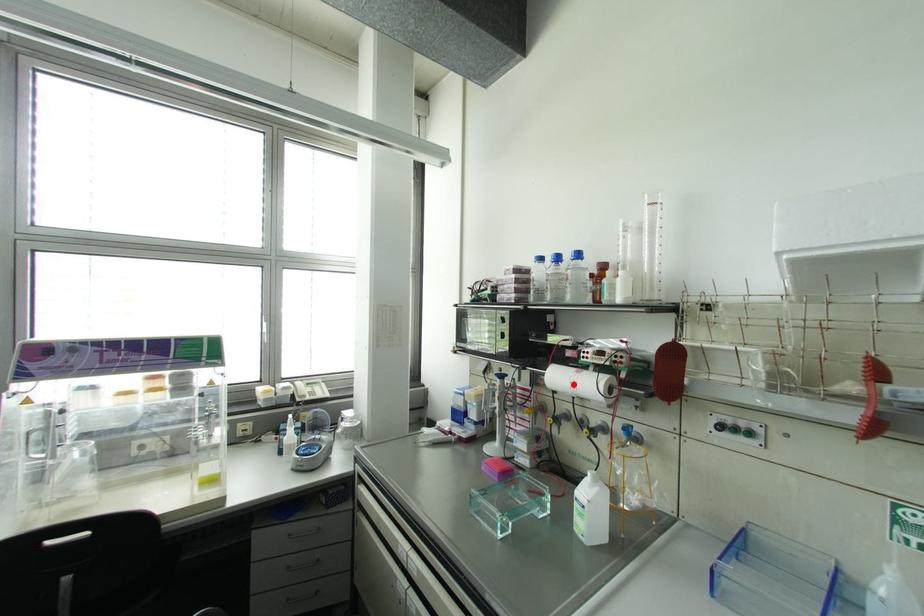
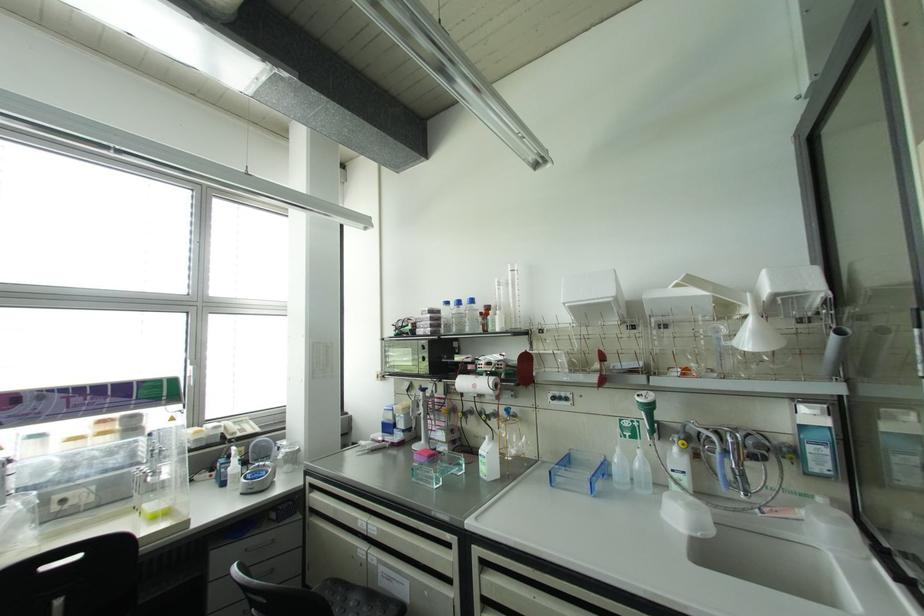
Find the pixel in the second image that matches the highlighted location in the first image.

(473, 386)